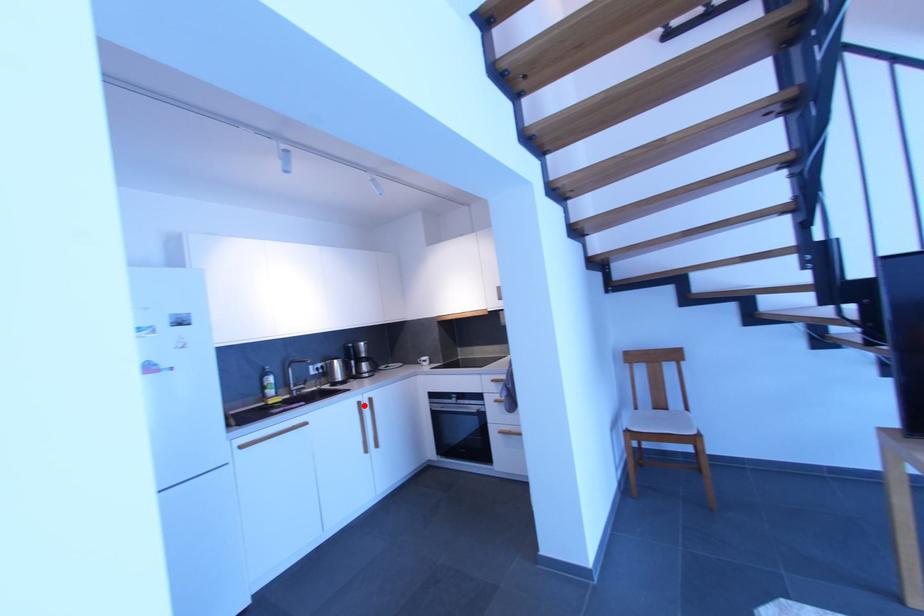
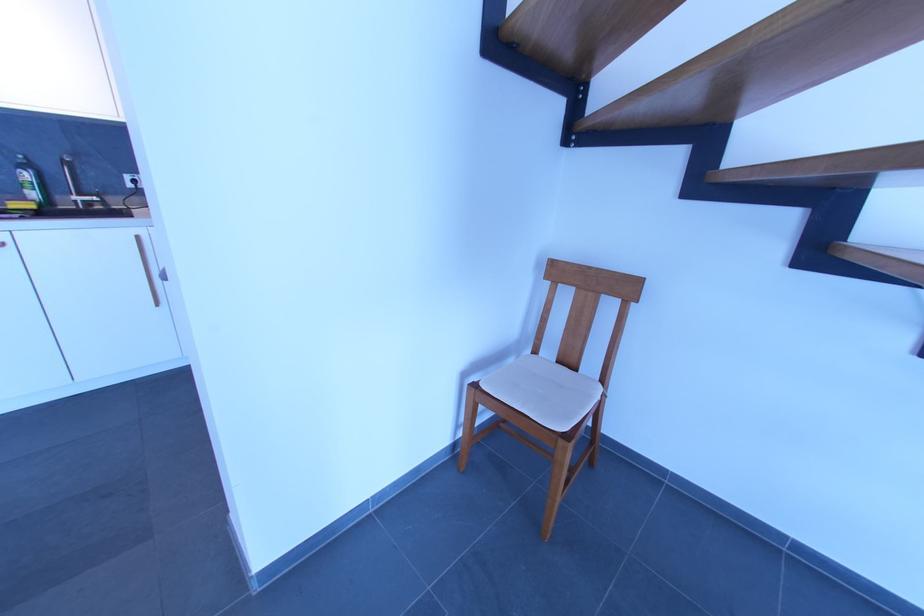
Question: I am providing you with two images of the same scene from different viewpoints. Given a red point in image1, look at the same physical point in image2. Is it:

Choices:
 (A) Closer to the viewpoint
 (B) Farther from the viewpoint

Answer: (A)